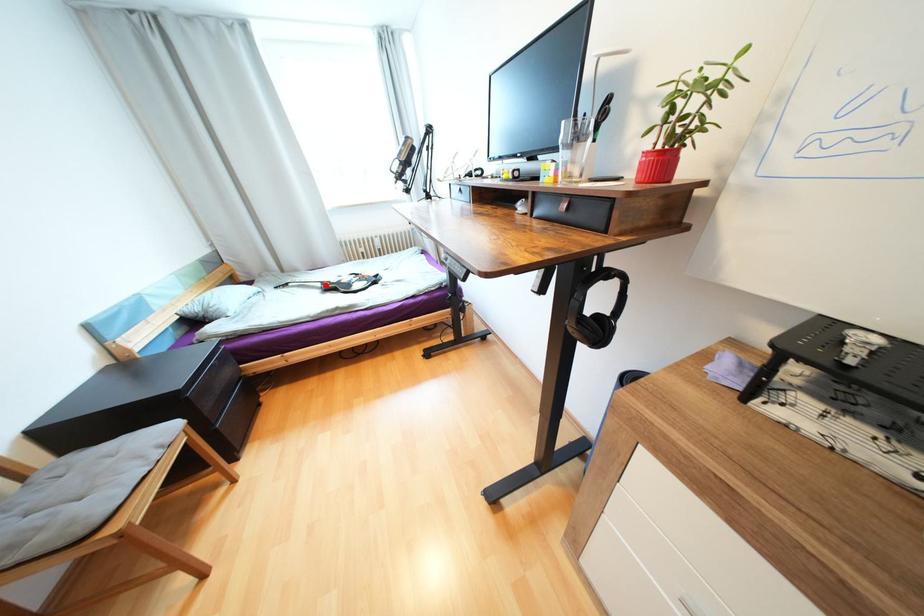
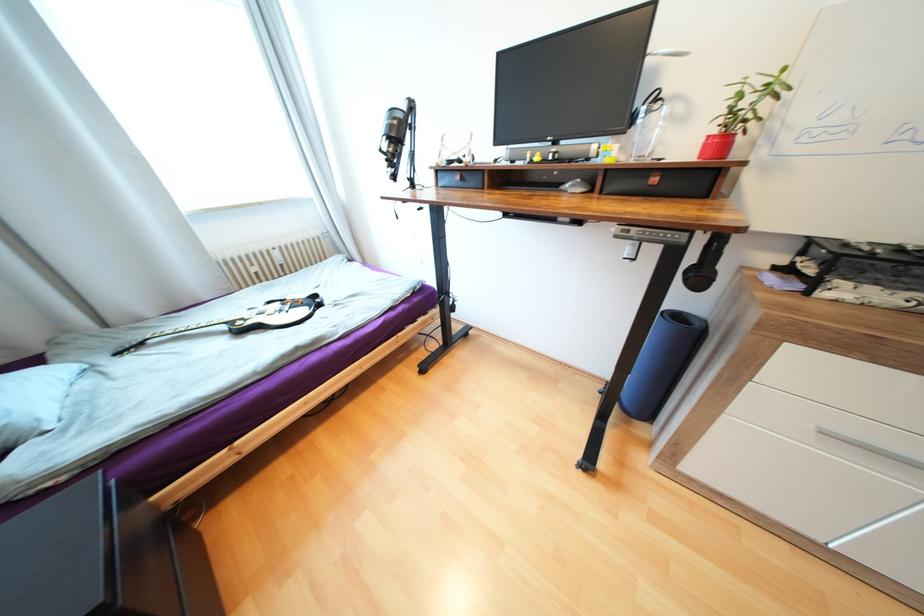
Locate, in the second image, the point that corresponds to the highlighted location in the first image.

(229, 328)